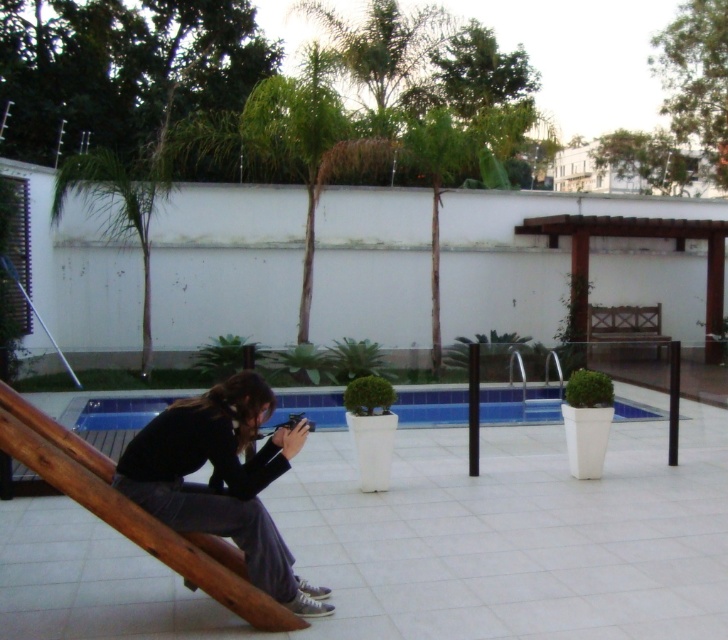
Does matte black camera at lower left appear under blue tile swimming pool at center?

Incorrect, matte black camera at lower left is not positioned below blue tile swimming pool at center.

Is point (213, 508) positioned before point (480, 390)?

That is True.

Between point (264, 566) and point (304, 392), which one is positioned in front?

Point (264, 566) is more forward.

Identify the location of matte black camera at lower left. This screenshot has height=640, width=728. (221, 480).